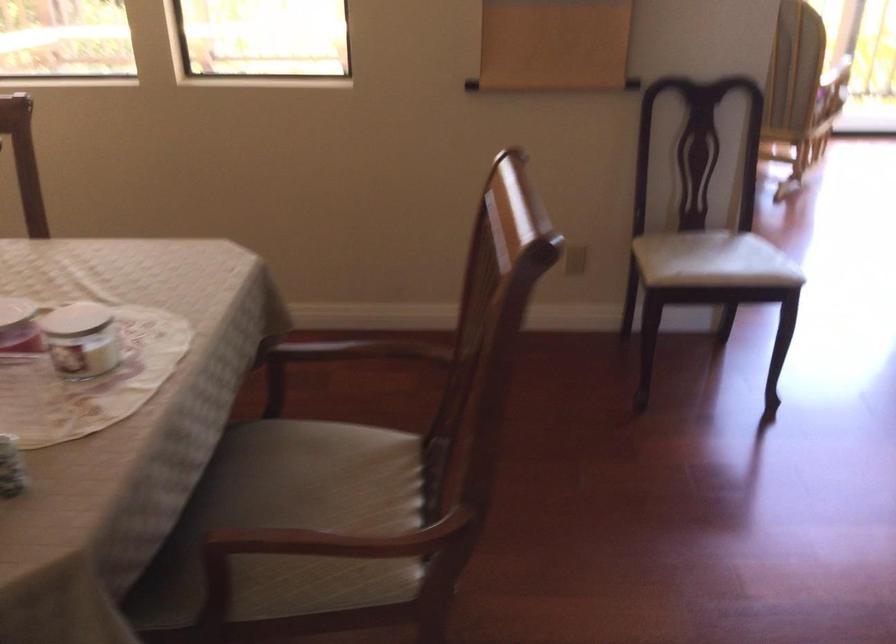
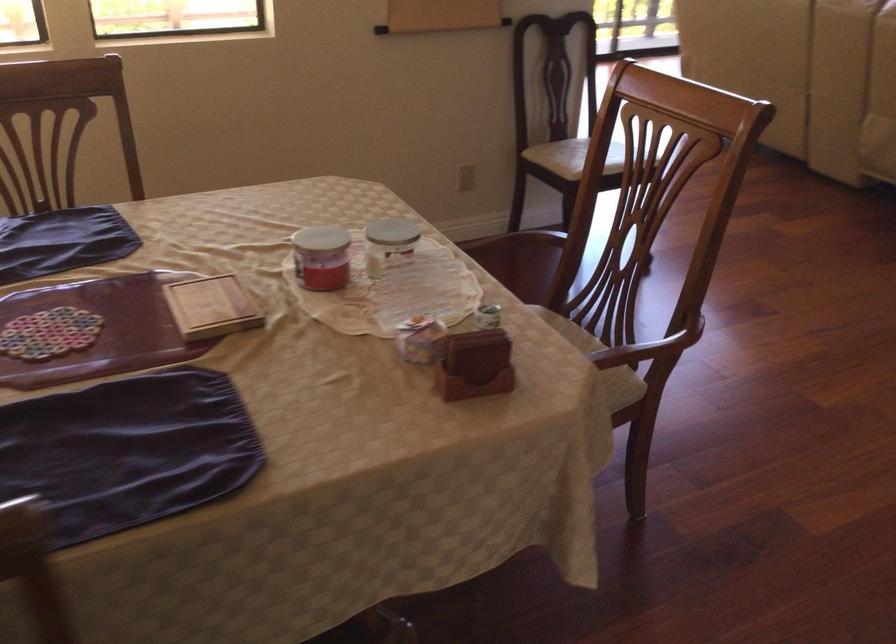
In the second image, find the point that corresponds to [398,466] in the first image.

(564, 322)